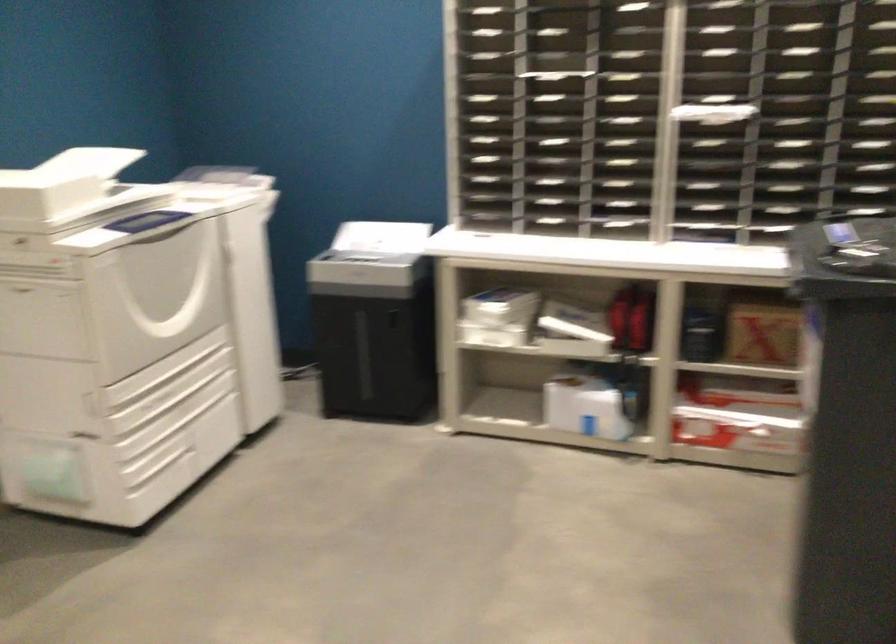
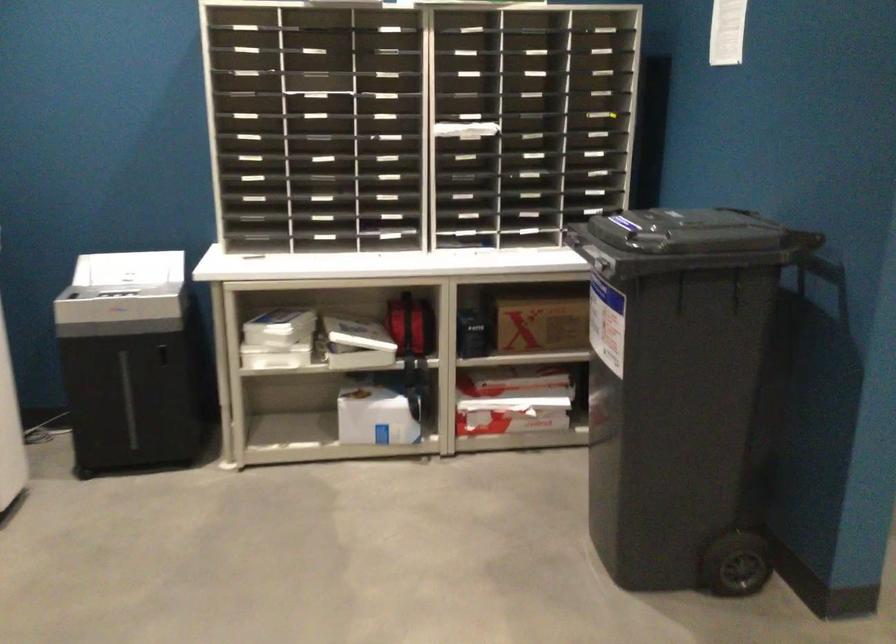
Question: What movement of the cameraman would produce the second image?

Choices:
 (A) Left
 (B) Right
 (C) Forward
 (D) Backward

Answer: (A)